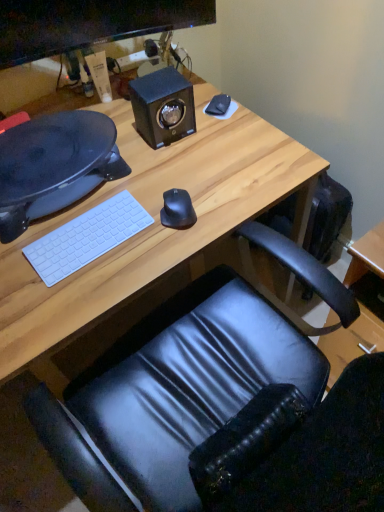
Locate an element on the screen. This screenshot has height=512, width=384. empty space that is in between white matte keyboard at lower left and black glossy speaker at left is located at coordinates (91, 210).